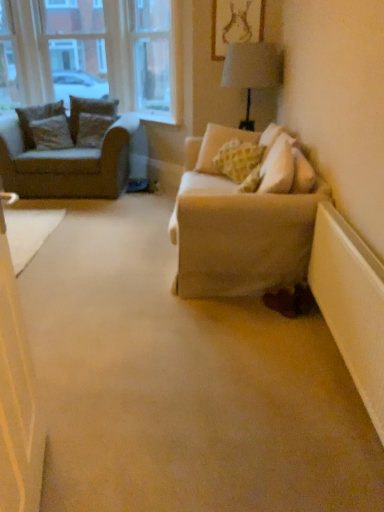
Where is `vacant area that is in front of beige fabric armchair at left`? vacant area that is in front of beige fabric armchair at left is located at coordinates (74, 220).